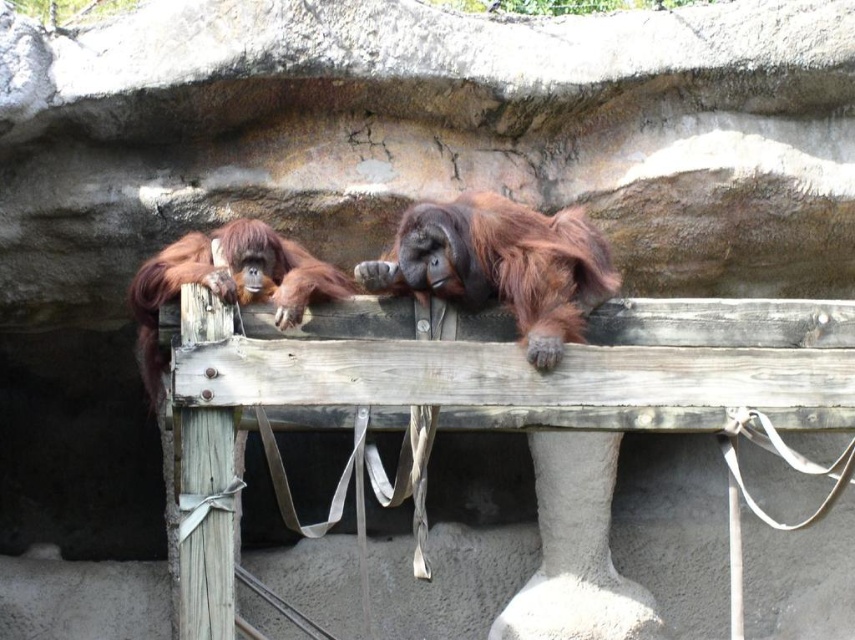
Does orange fur orangutan at center come in front of orange fur orangutan at left?

No, it is not.

Locate an element on the screen. The height and width of the screenshot is (640, 855). orange fur orangutan at center is located at coordinates [x=500, y=266].

Is point (553, 244) in front of point (274, 288)?

No.

I want to click on orange fur orangutan at center, so click(x=500, y=266).